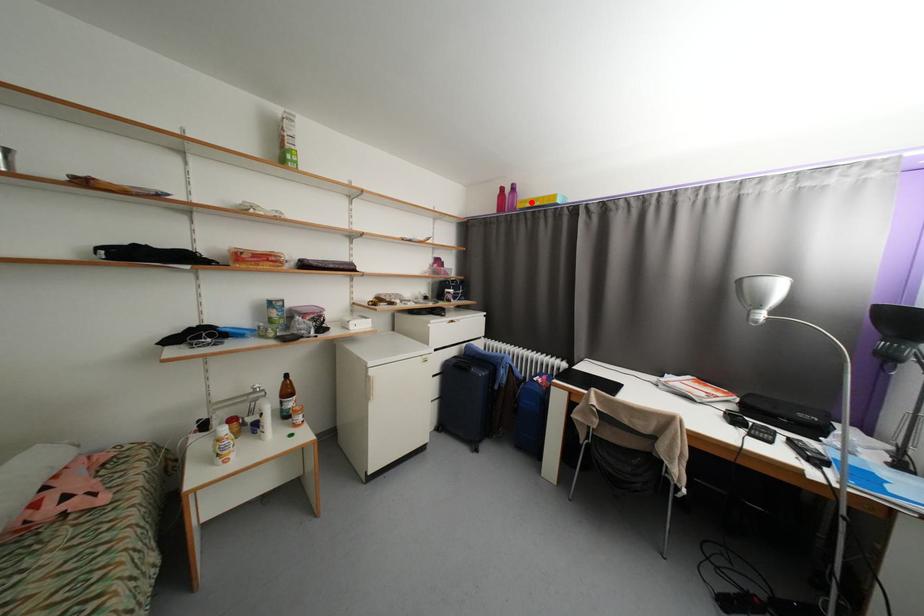
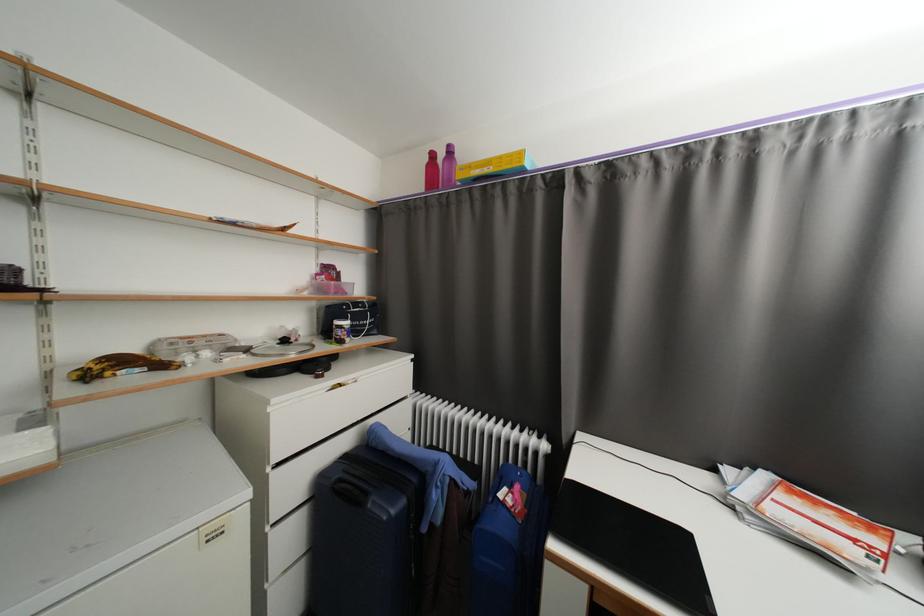
Locate, in the second image, the point that corresponds to the highlighted location in the first image.

(476, 168)